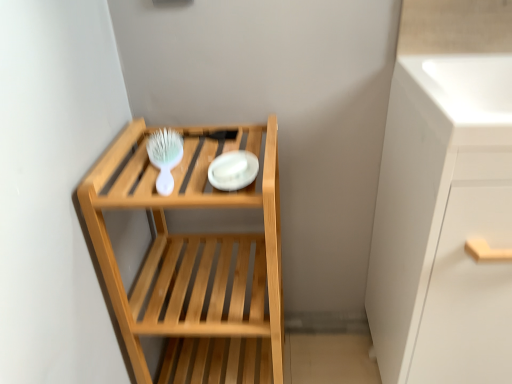
You are a GUI agent. You are given a task and a screenshot of the screen. Output one action in this format:
    pyautogui.click(x=<x>, y=<y>)
    Task: Click on the vacant space behind white plastic brush at upper left
    The width and height of the screenshot is (512, 384).
    Given the screenshot: What is the action you would take?
    pos(184,129)